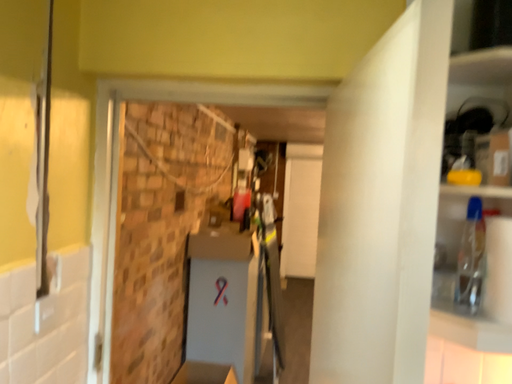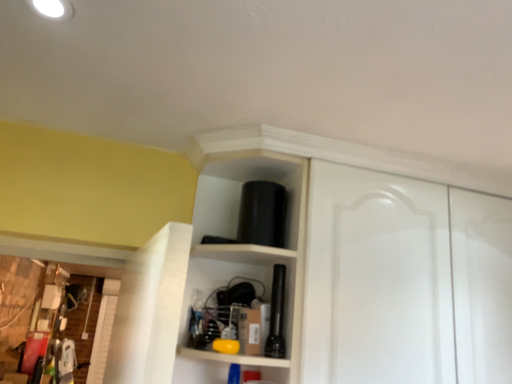
Question: How did the camera likely rotate when shooting the video?

Choices:
 (A) rotated right
 (B) rotated left

Answer: (A)